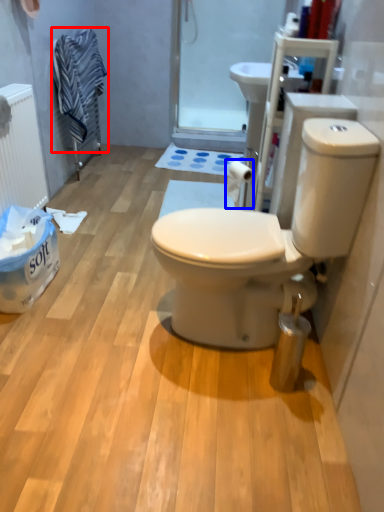
Question: Which point is closer to the camera, laundry (highlighted by a red box) or toilet paper (highlighted by a blue box)?

Choices:
 (A) laundry
 (B) toilet paper

Answer: (B)